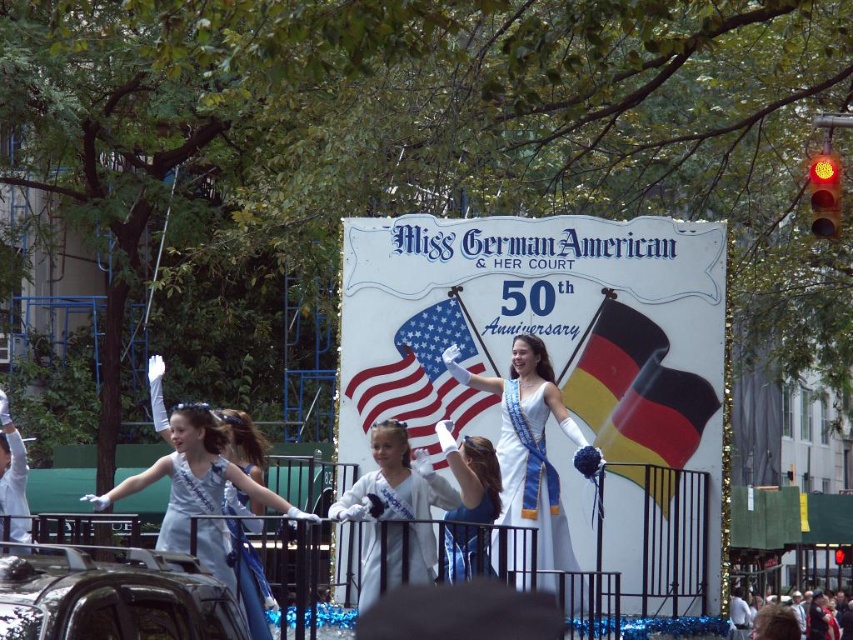
Question: Can you confirm if american flag at center is bigger than white satin dress at center?

Choices:
 (A) yes
 (B) no

Answer: (A)

Question: Is yellow-black-red fabric flag at center positioned in front of white satin dress at center?

Choices:
 (A) no
 (B) yes

Answer: (A)

Question: Where is yellow-black-red fabric flag at center located in relation to white cotton shirt at lower right in the image?

Choices:
 (A) below
 (B) above

Answer: (B)

Question: Which point appears closest to the camera in this image?

Choices:
 (A) (508, 372)
 (B) (403, 372)
 (C) (664, 406)

Answer: (C)

Question: Which point is closer to the camera?

Choices:
 (A) white satin dress at center
 (B) american flag at center

Answer: (A)

Question: Which point is closer to the camera?

Choices:
 (A) (428, 442)
 (B) (766, 636)
 (C) (401, 486)

Answer: (C)